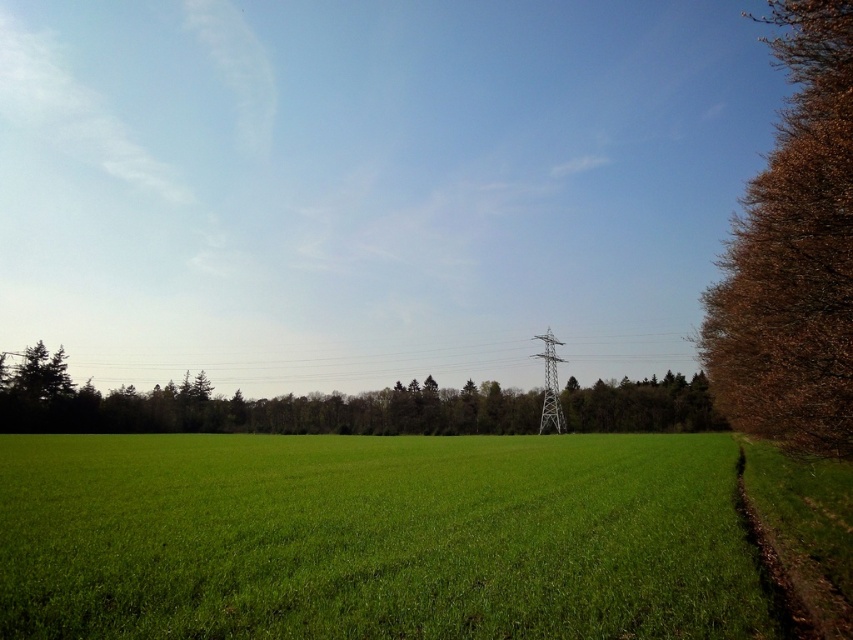
Question: Can you confirm if green grassy field at lower center is thinner than brown textured tree at right?

Choices:
 (A) no
 (B) yes

Answer: (B)

Question: Does brown textured tree at right have a greater width compared to metallic silver power line at center?

Choices:
 (A) no
 (B) yes

Answer: (A)

Question: Which of the following is the closest to the observer?

Choices:
 (A) metallic silver power line at center
 (B) green grassy field at lower center
 (C) brown textured tree at right

Answer: (B)

Question: Which point is farther from the camera taking this photo?

Choices:
 (A) (213, 381)
 (B) (589, 568)

Answer: (A)

Question: Which point is farther to the camera?

Choices:
 (A) (711, 486)
 (B) (801, 417)
 (C) (463, 348)

Answer: (C)

Question: Is brown textured tree at right further to camera compared to metallic silver power line at center?

Choices:
 (A) no
 (B) yes

Answer: (A)